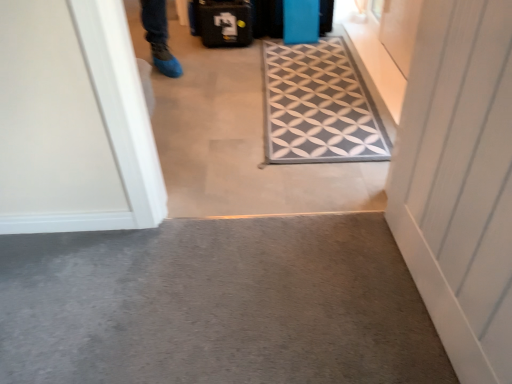
Question: Is black textured suitcase at upper center, which ranks as the 2th luggage in right-to-left order, positioned beyond the bounds of gray fabric doormat at center?

Choices:
 (A) no
 (B) yes

Answer: (B)

Question: From a real-world perspective, is black textured suitcase at upper center, the 1th luggage viewed from the left, beneath gray fabric doormat at center?

Choices:
 (A) no
 (B) yes

Answer: (A)

Question: Does black textured suitcase at upper center, the 1th luggage viewed from the left, appear on the left side of gray fabric doormat at center?

Choices:
 (A) yes
 (B) no

Answer: (A)

Question: Does black textured suitcase at upper center, which ranks as the 2th luggage in right-to-left order, have a larger size compared to gray fabric doormat at center?

Choices:
 (A) no
 (B) yes

Answer: (B)

Question: Is gray fabric doormat at center at the back of black textured suitcase at upper center, the 1th luggage viewed from the left?

Choices:
 (A) no
 (B) yes

Answer: (A)

Question: Can you confirm if black textured suitcase at upper center, the 1th luggage viewed from the left, is taller than gray fabric doormat at center?

Choices:
 (A) no
 (B) yes

Answer: (B)

Question: Can you confirm if blue matte suitcase at upper center, the second luggage viewed from the left, is smaller than white wood door at right?

Choices:
 (A) no
 (B) yes

Answer: (B)

Question: Is blue matte suitcase at upper center, which is the first luggage in right-to-left order, positioned with its back to white wood door at right?

Choices:
 (A) no
 (B) yes

Answer: (A)

Question: Could you tell me if blue matte suitcase at upper center, the second luggage viewed from the left, is turned towards white wood door at right?

Choices:
 (A) no
 (B) yes

Answer: (B)

Question: Can you confirm if blue matte suitcase at upper center, which is the first luggage in right-to-left order, is wider than white wood door at right?

Choices:
 (A) yes
 (B) no

Answer: (A)

Question: Is blue matte suitcase at upper center, the second luggage viewed from the left, at the left side of white wood door at right?

Choices:
 (A) no
 (B) yes

Answer: (B)

Question: Is white wood door at right located outside carpeted floor at center?

Choices:
 (A) yes
 (B) no

Answer: (A)